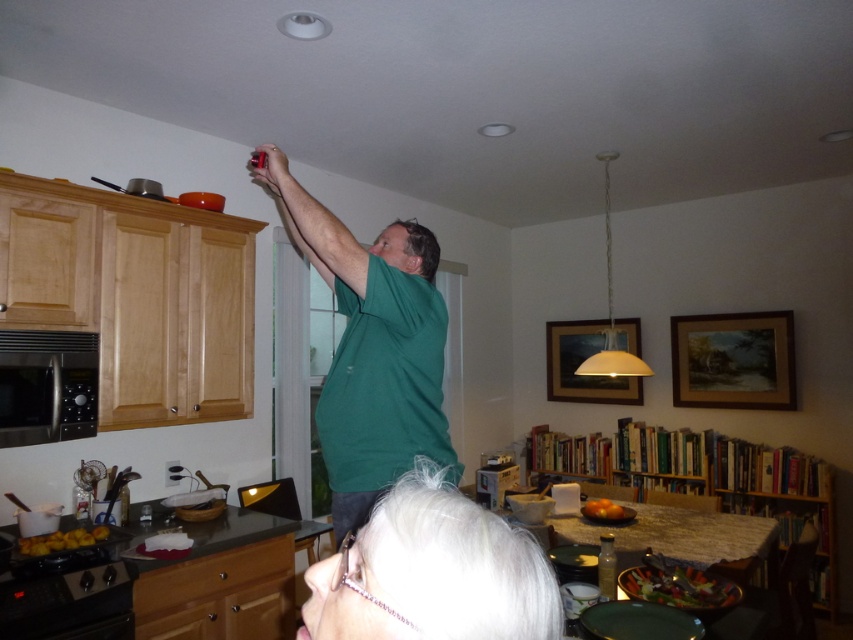
In the kitchen scene, you need to locate the white hair at lower center and the stainless steel microwave at left. Which object is positioned to the right of the other?

The white hair at lower center is positioned to the right of the stainless steel microwave at left.

You are planning to hang a picture frame that requires a hook placed at 1.8 meters height. Given the positions of the green matte shirt at upper center and the stainless steel microwave at left, which object is closer to the required hook height?

The green matte shirt at upper center has a greater height compared to the stainless steel microwave at left. Since the required hook height is 1.8 meters, the green matte shirt at upper center is closer to that height than the microwave.

You are a guest in this kitchen and want to ask the person with white hair at lower center for a drink. To get their attention, you need to know if they are facing towards the stainless steel microwave at left. Can you determine this based on their position?

The white hair at lower center is below the stainless steel microwave at left, so the person with white hair at lower center is likely facing away from the microwave since they are seated at the table below it.